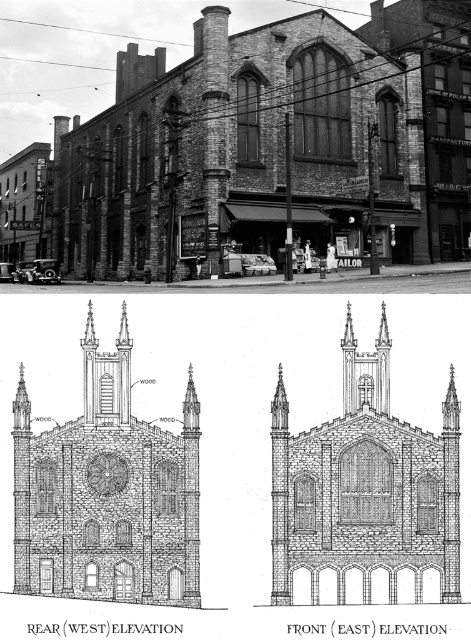
Is brick church at center below wooden church at center?

Yes, brick church at center is below wooden church at center.

Is brick church at center closer to camera compared to wooden church at center?

No, it is behind wooden church at center.

Is point (274, 410) less distant than point (175, 541)?

No, it is not.

This screenshot has height=640, width=471. I want to click on brick church at center, so click(x=365, y=493).